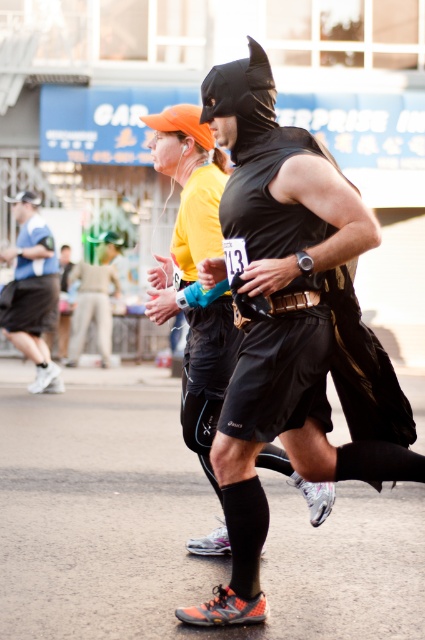
You are a photographer positioned at the starting line of the marathon. You want to capture a closeup shot of the matte black costume at center. Given that your camera has a minimum focusing distance of 4 meters, will you be able to take the photo without moving closer?

The matte black costume at center is 4.14 meters away from camera, which is just beyond the camera minimum focusing distance of 4 meters. Therefore, you can take the photo without moving closer.

You are a race official trying to locate the runner in the Batman costume during the marathon. According to the coordinates provided, where exactly is the matte black costume at center positioned in the image?

The matte black costume at center is located at point (x=289, y=324), which corresponds to the center area of the image.

You are a race official at a marathon and need to determine if the gap between the black matte vest at center and the matte blue shirt at left is large enough for a 5 meter sprint zone. Can you confirm if the gap allows for a 5 meter sprint zone?

The distance between the black matte vest at center and the matte blue shirt at left is 6.56 meters, which is larger than the required 5 meters, so the gap allows for a 5 meter sprint zone.